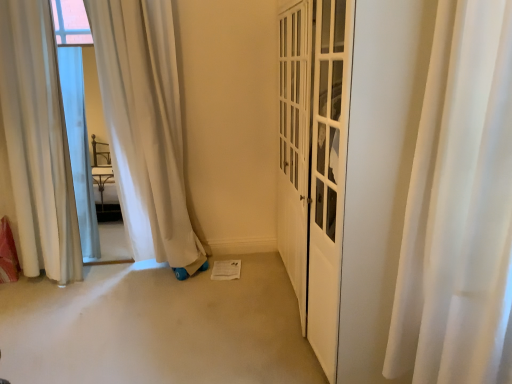
The width and height of the screenshot is (512, 384). I want to click on free point to the right of white sheer curtain at left, placed as the second curtain when sorted from right to left, so click(x=94, y=294).